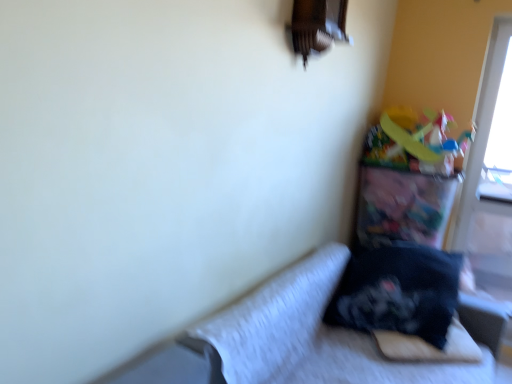
Question: Would you say velvet black pillow at lower right is a long distance from transparent plastic screen door at right?

Choices:
 (A) yes
 (B) no

Answer: (A)

Question: Is velvet black pillow at lower right with transparent plastic screen door at right?

Choices:
 (A) no
 (B) yes

Answer: (A)

Question: Would you say velvet black pillow at lower right is outside transparent plastic screen door at right?

Choices:
 (A) yes
 (B) no

Answer: (A)

Question: From a real-world perspective, is velvet black pillow at lower right positioned over transparent plastic screen door at right based on gravity?

Choices:
 (A) no
 (B) yes

Answer: (A)

Question: Considering the relative sizes of velvet black pillow at lower right and transparent plastic screen door at right in the image provided, is velvet black pillow at lower right taller than transparent plastic screen door at right?

Choices:
 (A) yes
 (B) no

Answer: (B)

Question: From the image's perspective, would you say velvet black pillow at lower right is shown under transparent plastic screen door at right?

Choices:
 (A) yes
 (B) no

Answer: (A)

Question: Considering the relative positions of velvet black pillow at lower right and black soft pillow at lower right in the image provided, is velvet black pillow at lower right to the left of black soft pillow at lower right from the viewer's perspective?

Choices:
 (A) yes
 (B) no

Answer: (A)

Question: Is velvet black pillow at lower right placed right next to black soft pillow at lower right?

Choices:
 (A) yes
 (B) no

Answer: (B)

Question: Does velvet black pillow at lower right have a greater height compared to black soft pillow at lower right?

Choices:
 (A) yes
 (B) no

Answer: (A)

Question: Is velvet black pillow at lower right far away from black soft pillow at lower right?

Choices:
 (A) no
 (B) yes

Answer: (A)

Question: From a real-world perspective, is velvet black pillow at lower right below black soft pillow at lower right?

Choices:
 (A) no
 (B) yes

Answer: (B)

Question: Is velvet black pillow at lower right not within black soft pillow at lower right?

Choices:
 (A) yes
 (B) no

Answer: (A)

Question: Considering the relative sizes of black soft pillow at lower right and transparent plastic screen door at right in the image provided, is black soft pillow at lower right smaller than transparent plastic screen door at right?

Choices:
 (A) yes
 (B) no

Answer: (A)